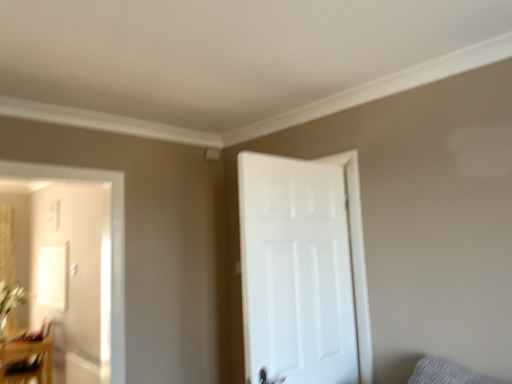
Question: Does green leafy plant at left have a smaller size compared to gray fabric pillow at lower right?

Choices:
 (A) yes
 (B) no

Answer: (B)

Question: From a real-world perspective, is green leafy plant at left physically below gray fabric pillow at lower right?

Choices:
 (A) no
 (B) yes

Answer: (A)

Question: From a real-world perspective, is green leafy plant at left over gray fabric pillow at lower right?

Choices:
 (A) no
 (B) yes

Answer: (B)

Question: Does green leafy plant at left have a lesser height compared to gray fabric pillow at lower right?

Choices:
 (A) yes
 (B) no

Answer: (B)

Question: Are green leafy plant at left and gray fabric pillow at lower right far apart?

Choices:
 (A) yes
 (B) no

Answer: (A)

Question: Considering the positions of gray fabric pillow at lower right and wooden table at lower left in the image, is gray fabric pillow at lower right bigger or smaller than wooden table at lower left?

Choices:
 (A) small
 (B) big

Answer: (A)

Question: Considering the positions of point (457, 380) and point (28, 364), is point (457, 380) closer or farther from the camera than point (28, 364)?

Choices:
 (A) farther
 (B) closer

Answer: (B)

Question: Looking at their shapes, would you say gray fabric pillow at lower right is wider or thinner than wooden table at lower left?

Choices:
 (A) thin
 (B) wide

Answer: (A)

Question: Would you say gray fabric pillow at lower right is inside or outside wooden table at lower left?

Choices:
 (A) inside
 (B) outside

Answer: (B)

Question: From their relative heights in the image, would you say wooden table at lower left is taller or shorter than gray fabric pillow at lower right?

Choices:
 (A) short
 (B) tall

Answer: (B)

Question: Is wooden table at lower left spatially inside gray fabric pillow at lower right, or outside of it?

Choices:
 (A) inside
 (B) outside

Answer: (B)

Question: Is wooden table at lower left bigger or smaller than gray fabric pillow at lower right?

Choices:
 (A) big
 (B) small

Answer: (A)

Question: Based on their positions, is wooden table at lower left located to the left or right of gray fabric pillow at lower right?

Choices:
 (A) right
 (B) left

Answer: (B)

Question: Is point (35, 360) closer or farther from the camera than point (370, 377)?

Choices:
 (A) farther
 (B) closer

Answer: (A)

Question: From their relative heights in the image, would you say wooden table at lower left is taller or shorter than white matte door at right?

Choices:
 (A) tall
 (B) short

Answer: (B)